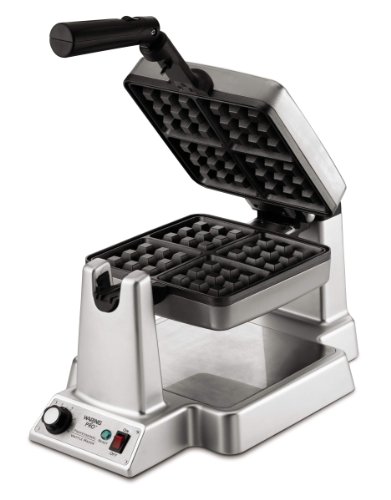
This screenshot has width=391, height=500. Find the location of `red on and off switch`. red on and off switch is located at coordinates (119, 441).